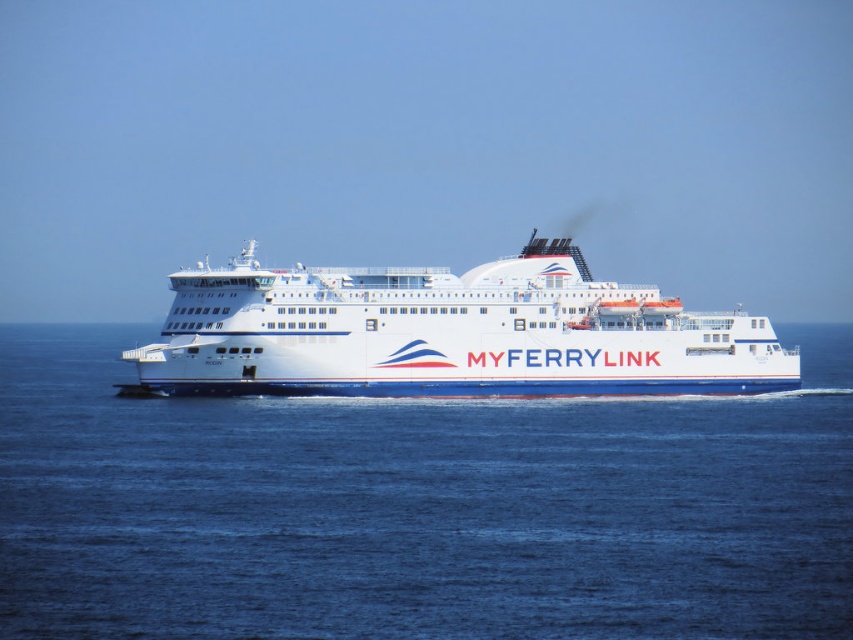
You are standing on a nearby boat and looking at the scene. Which object, the blue water at center or the white glossy ferry at center, is nearer to you?

The blue water at center is closer to the viewer than the white glossy ferry at center.

You are standing on the deck of the white glossy ferry at center. Looking out, you see the blue water at center. In which direction relative to the ferry is the blue water located?

The blue water at center is to the right of the white glossy ferry at center.

You are standing on the deck of the ferry MYFERRYLINK and want to take a photo. You notice two points marked on the ship. Which point, point [376,570] or point [225,372], will appear larger in your photo?

Point [376,570] will appear larger in the photo because it is closer to the camera than point [225,372].